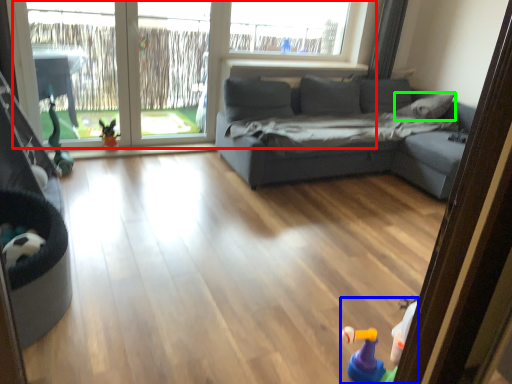
Question: Estimate the real-world distances between objects in this image. Which object is farther from window (highlighted by a red box), toy (highlighted by a blue box) or pillow (highlighted by a green box)?

Choices:
 (A) toy
 (B) pillow

Answer: (A)